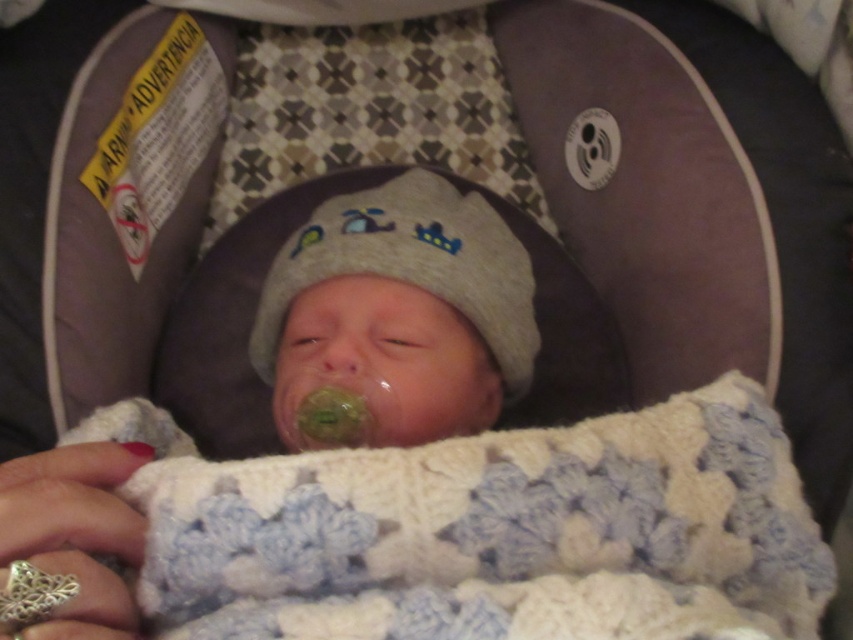
Can you confirm if white knitted blanket at center is bigger than silver metallic teething ring at lower left?

Yes.

The height and width of the screenshot is (640, 853). What do you see at coordinates (486, 531) in the screenshot? I see `white knitted blanket at center` at bounding box center [486, 531].

The image size is (853, 640). I want to click on white knitted blanket at center, so tap(486, 531).

How far apart are gray knit hat at center and silver metallic teething ring at lower left?

gray knit hat at center is 13.08 inches from silver metallic teething ring at lower left.

Consider the image. Who is positioned more to the left, gray knit hat at center or silver metallic teething ring at lower left?

Positioned to the left is silver metallic teething ring at lower left.

At what (x,y) coordinates should I click in order to perform the action: click on gray knit hat at center. Please return your answer as a coordinate pair (x, y). The image size is (853, 640). Looking at the image, I should click on (412, 266).

You are a GUI agent. You are given a task and a screenshot of the screen. Output one action in this format:
    pyautogui.click(x=<x>, y=<y>)
    Task: Click on the gray knit hat at center
    This screenshot has width=853, height=640.
    Given the screenshot: What is the action you would take?
    pyautogui.click(x=412, y=266)

Who is more forward, (183,474) or (318,268)?

Point (183,474) is in front.

Is white knitted blanket at center bigger than gray knit hat at center?

Yes.

Image resolution: width=853 pixels, height=640 pixels. What do you see at coordinates (486, 531) in the screenshot?
I see `white knitted blanket at center` at bounding box center [486, 531].

Locate an element on the screen. The width and height of the screenshot is (853, 640). white knitted blanket at center is located at coordinates (486, 531).